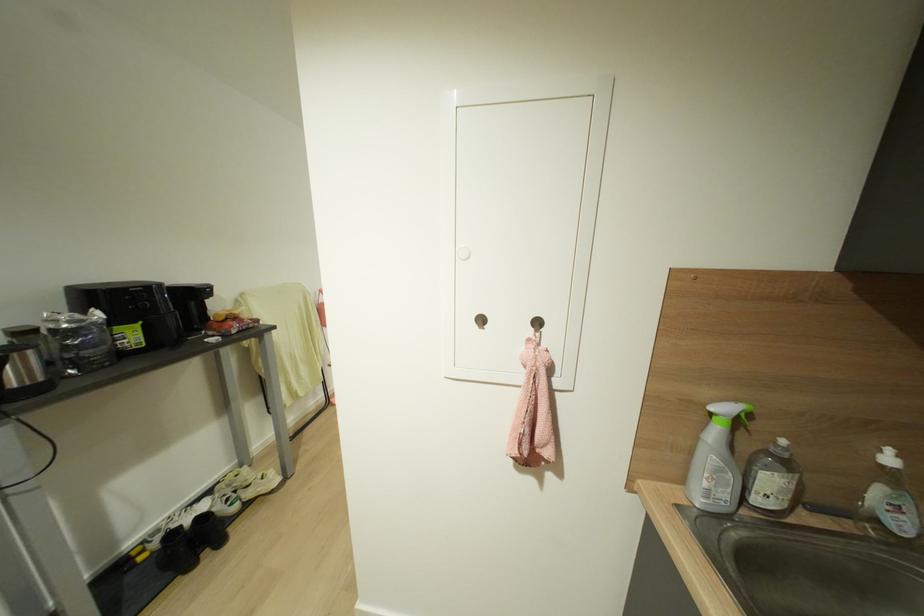
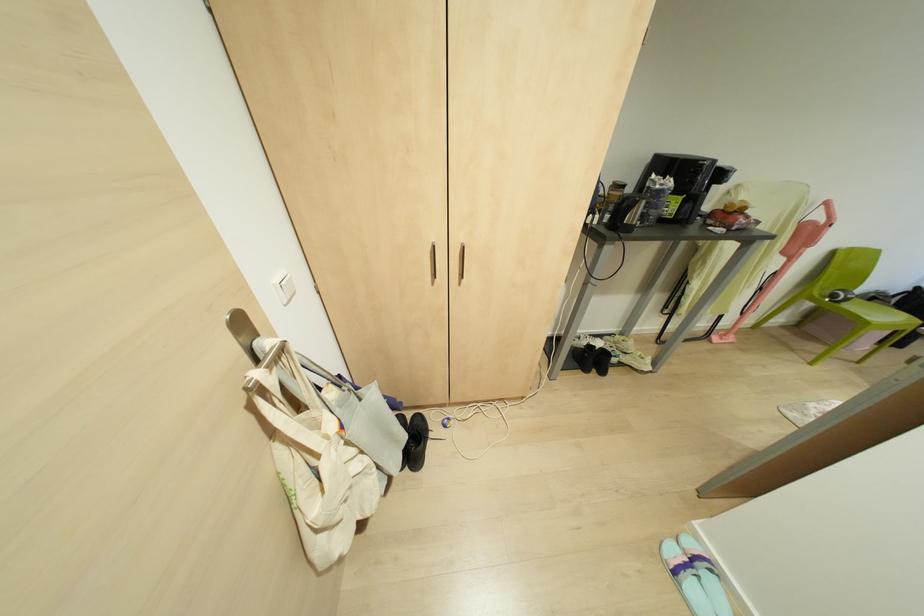
In the second image, find the point that corresponds to (x=98, y=315) in the first image.

(670, 182)